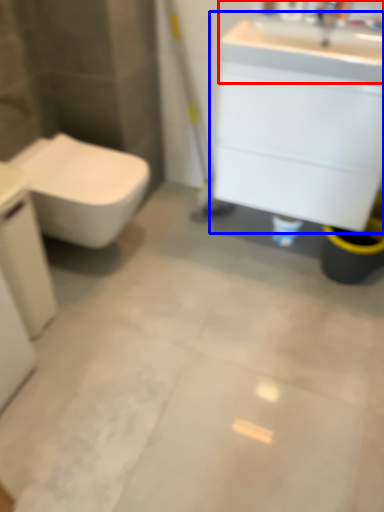
Question: Among these objects, which one is farthest to the camera, sink (highlighted by a red box) or bathroom cabinet (highlighted by a blue box)?

Choices:
 (A) sink
 (B) bathroom cabinet

Answer: (B)